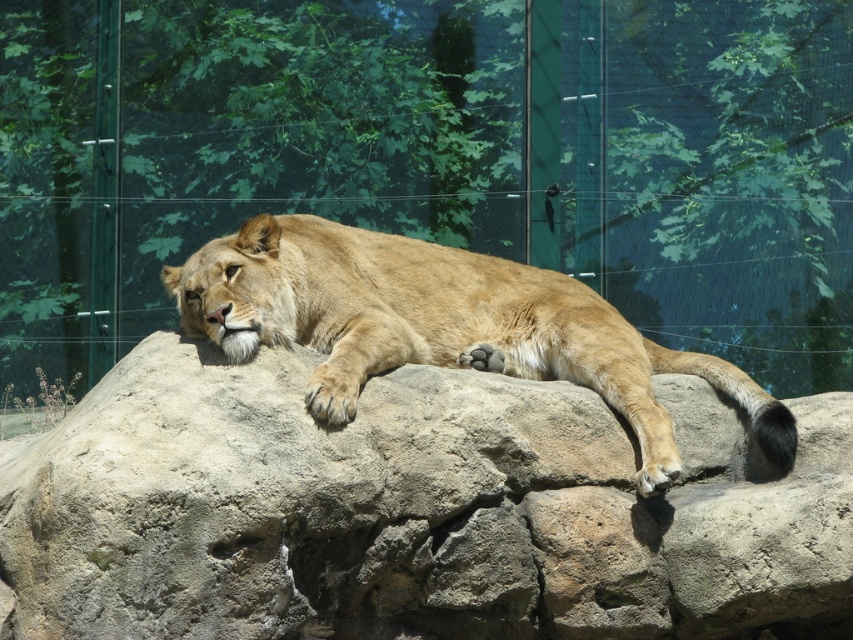
Question: Which of the following is the closest to the observer?

Choices:
 (A) smooth rock at center
 (B) golden fur lion at center

Answer: (A)

Question: Which point is farther to the camera?

Choices:
 (A) (343, 240)
 (B) (679, 387)

Answer: (B)

Question: Does smooth rock at center appear over golden fur lion at center?

Choices:
 (A) yes
 (B) no

Answer: (B)

Question: Is smooth rock at center below golden fur lion at center?

Choices:
 (A) no
 (B) yes

Answer: (B)

Question: Can you confirm if smooth rock at center is positioned above golden fur lion at center?

Choices:
 (A) yes
 (B) no

Answer: (B)